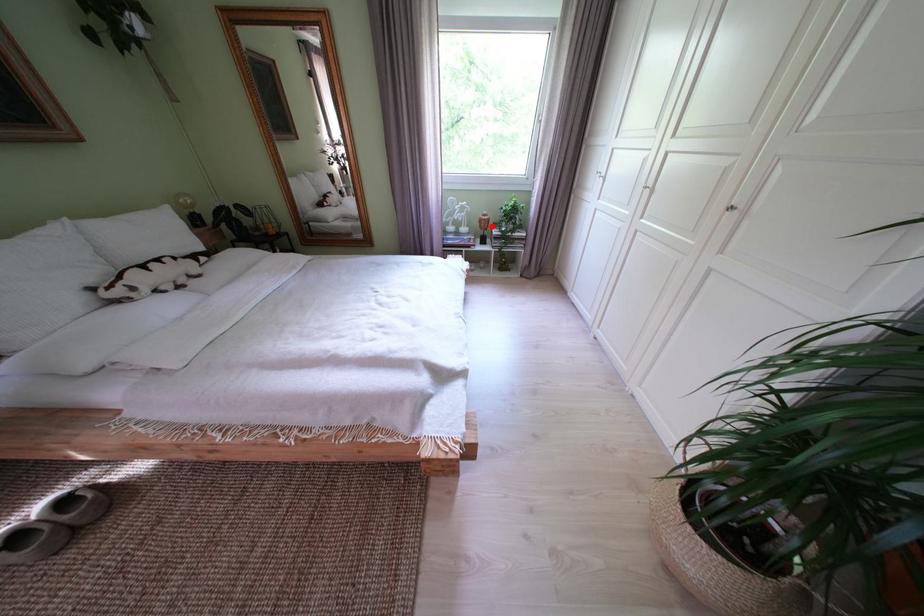
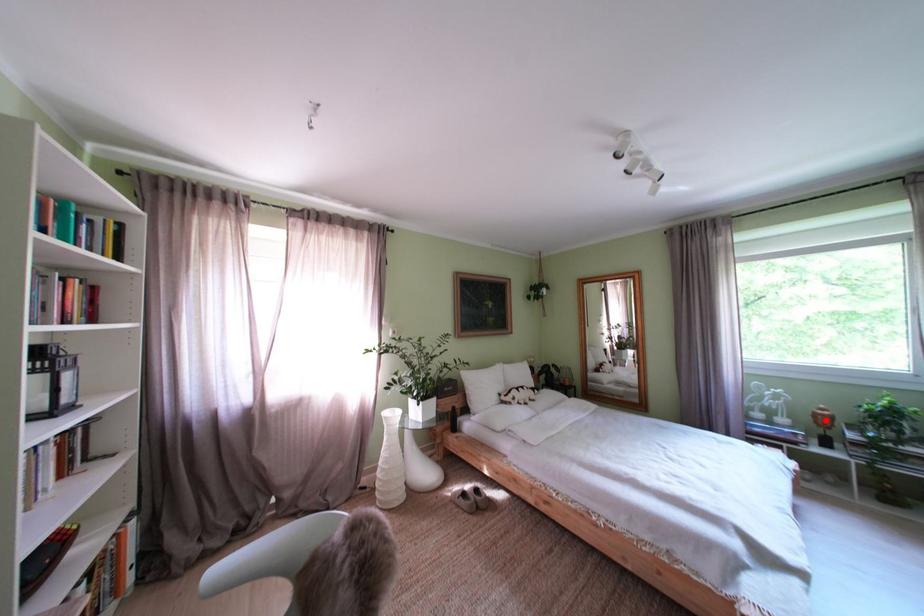
I am providing you with two images of the same scene from different viewpoints. A red point is marked on the first image and another point is marked on the second image. Are the points marked in image1 and image2 representing the same 3D position?

Yes